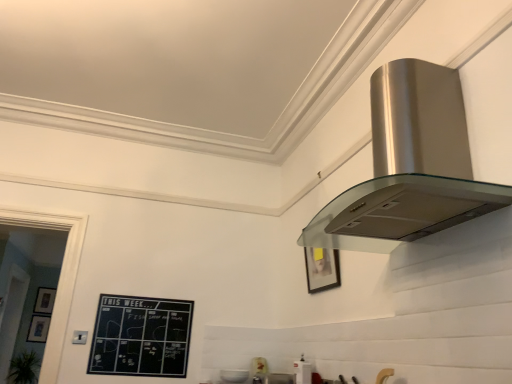
Where is `vacant point above black chalkboard at lower left (from a real-world perspective)`? This screenshot has height=384, width=512. vacant point above black chalkboard at lower left (from a real-world perspective) is located at coordinates (150, 291).